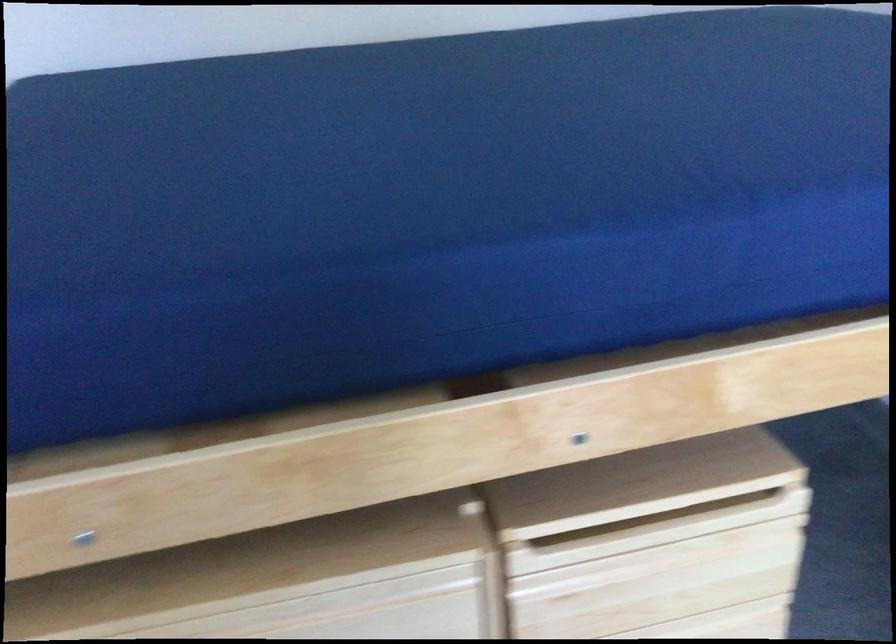
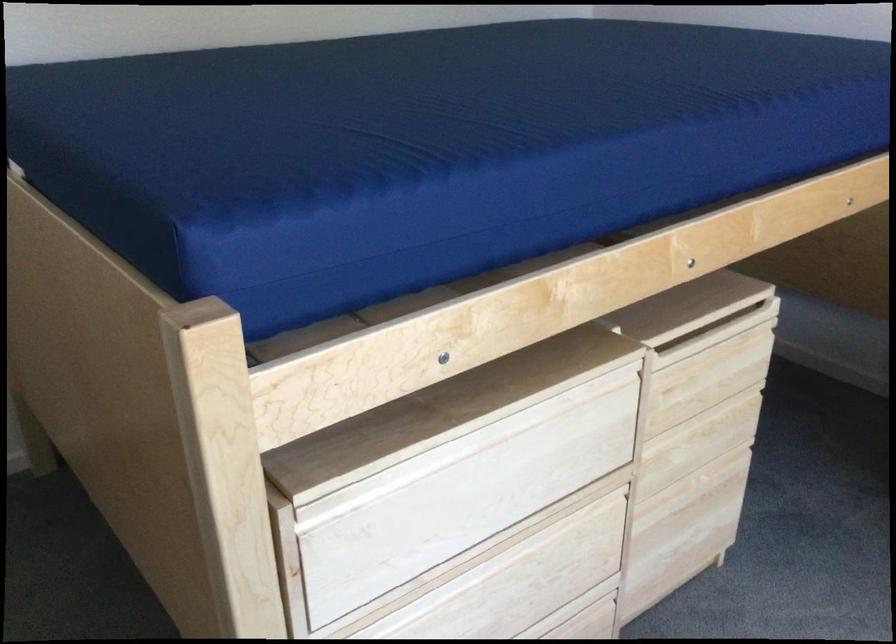
Question: The images are taken continuously from a first-person perspective. In which direction is your viewpoint rotating?

Choices:
 (A) Left
 (B) Right
 (C) Up
 (D) Down

Answer: (B)